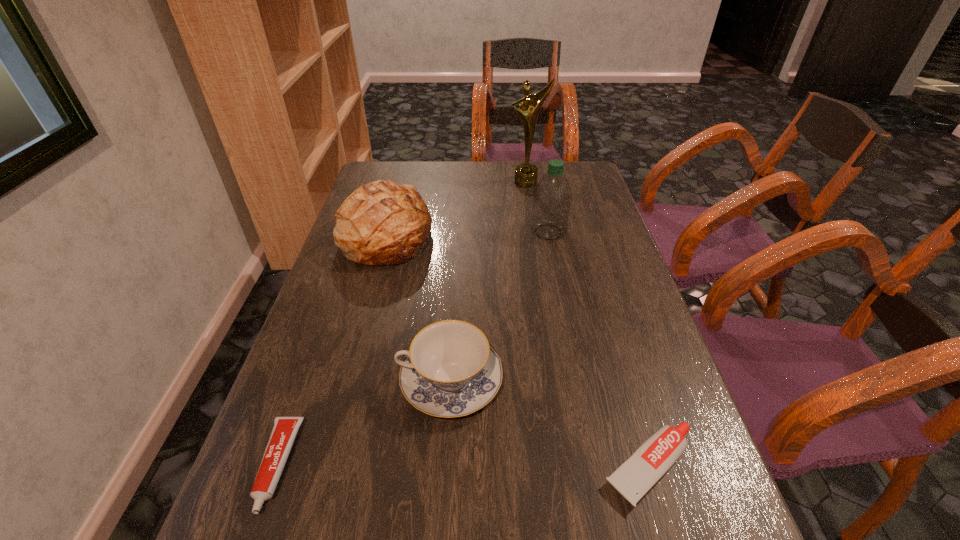
You are a GUI agent. You are given a task and a screenshot of the screen. Output one action in this format:
    pyautogui.click(x=<x>, y=<y>)
    Task: Click on the award
    
    Given the screenshot: What is the action you would take?
    pyautogui.click(x=525, y=175)

Find the location of a particular element. This screenshot has width=960, height=540. the tallest object is located at coordinates (525, 175).

You are a GUI agent. You are given a task and a screenshot of the screen. Output one action in this format:
    pyautogui.click(x=<x>, y=<y>)
    Task: Click on the second tallest object
    
    Given the screenshot: What is the action you would take?
    pyautogui.click(x=552, y=197)

This screenshot has width=960, height=540. I want to click on the fourth shortest object, so click(x=381, y=223).

Find the location of a particular element. The height and width of the screenshot is (540, 960). the fourth tallest object is located at coordinates (450, 370).

Locate an element on the screen. This screenshot has height=540, width=960. the right toothpaste is located at coordinates (635, 477).

Image resolution: width=960 pixels, height=540 pixels. In order to click on the fifth tallest object in this screenshot , I will do `click(635, 477)`.

Find the location of a particular element. Image resolution: width=960 pixels, height=540 pixels. the shortest object is located at coordinates (x=284, y=431).

The width and height of the screenshot is (960, 540). Identify the location of the left toothpaste. (284, 431).

This screenshot has height=540, width=960. Identify the location of blank space located 0.210m on the front-facing side of the award. (533, 223).